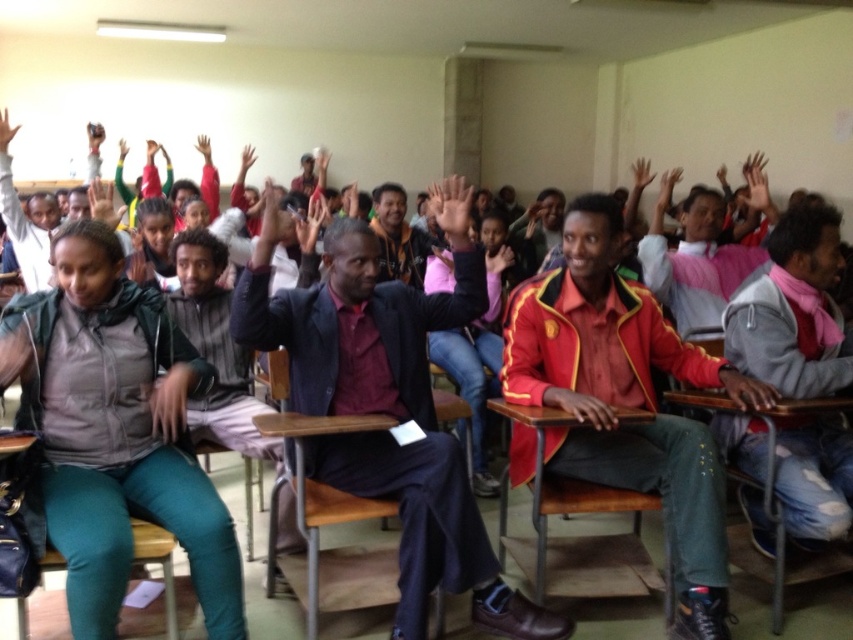
You are a photographer trying to capture a candid shot of the maroon fabric shirt at center and the red leather jacket at center during the discussion. Since you want to ensure both are clearly visible, which one should you focus on first to account for their sizes?

The maroon fabric shirt at center has a larger size compared to the red leather jacket at center, so you should focus on the maroon fabric shirt at center first to ensure its details are captured clearly before adjusting for the smaller red leather jacket at center.

You are standing at the entrance of the classroom and want to locate the person wearing the maroon fabric shirt at center. According to the coordinates provided, where should you look to find them?

The maroon fabric shirt at center is located at the coordinates point (389, 404), so you should look towards the center of the classroom to find them.

In the classroom scene, there are several people participating actively. You notice a point at coordinates (389, 404). What is located at this point?

The point at coordinates (389, 404) marks the location of the maroon fabric shirt at center.